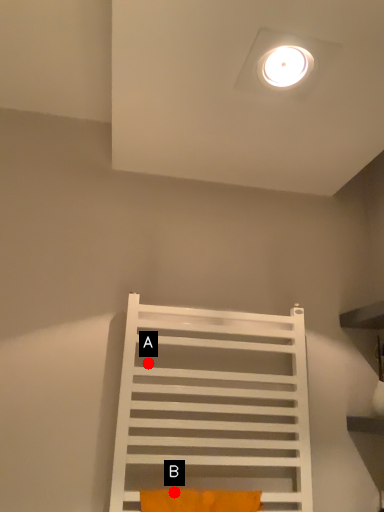
Question: Two points are circled on the image, labeled by A and B beside each circle. Which point is closer to the camera taking this photo?

Choices:
 (A) A is closer
 (B) B is closer

Answer: (B)